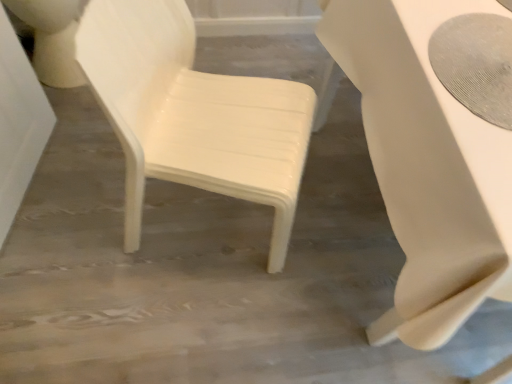
Where is `vacant space to the right of white glossy chair at center`? vacant space to the right of white glossy chair at center is located at coordinates (335, 236).